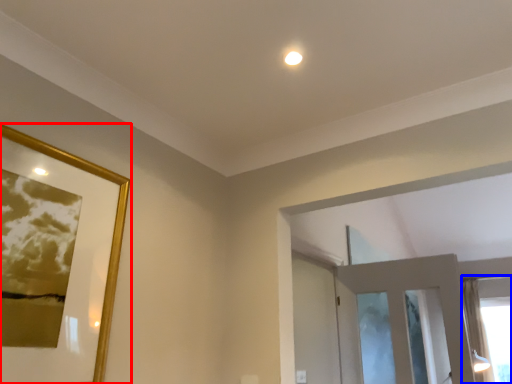
Question: Which object appears closest to the camera in this image, picture frame (highlighted by a red box) or window (highlighted by a blue box)?

Choices:
 (A) picture frame
 (B) window

Answer: (A)